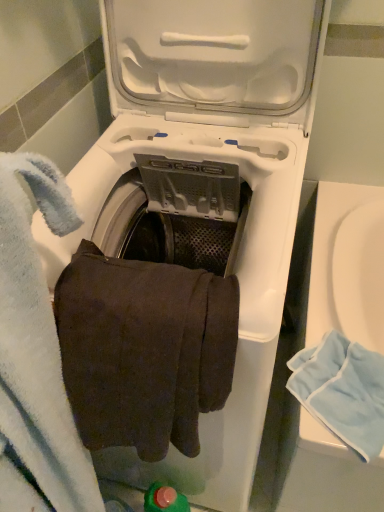
Question: Is light blue cotton towel at lower right, which is the first bath towel from right to left, to the left or to the right of brown cotton towel at center, the 2th bath towel positioned from the right, in the image?

Choices:
 (A) right
 (B) left

Answer: (A)

Question: From the image's perspective, is light blue cotton towel at lower right, which is the first bath towel from right to left, located above or below brown cotton towel at center, the 2th bath towel positioned from the right?

Choices:
 (A) above
 (B) below

Answer: (B)

Question: From a real-world perspective, is light blue cotton towel at lower right, which ranks as the second bath towel in left-to-right order, above or below brown cotton towel at center, the 2th bath towel positioned from the right?

Choices:
 (A) above
 (B) below

Answer: (B)

Question: Looking at their shapes, would you say brown cotton towel at center, the first bath towel viewed from the left, is wider or thinner than light blue cotton towel at lower right, which is the first bath towel from right to left?

Choices:
 (A) wide
 (B) thin

Answer: (B)

Question: In the image, is brown cotton towel at center, the first bath towel viewed from the left, positioned in front of or behind light blue cotton towel at lower right, which is the first bath towel from right to left?

Choices:
 (A) front
 (B) behind

Answer: (A)

Question: Considering the positions of point (157, 357) and point (380, 369), is point (157, 357) closer or farther from the camera than point (380, 369)?

Choices:
 (A) closer
 (B) farther

Answer: (A)

Question: Is brown cotton towel at center, the 2th bath towel positioned from the right, taller or shorter than light blue cotton towel at lower right, which ranks as the second bath towel in left-to-right order?

Choices:
 (A) tall
 (B) short

Answer: (A)